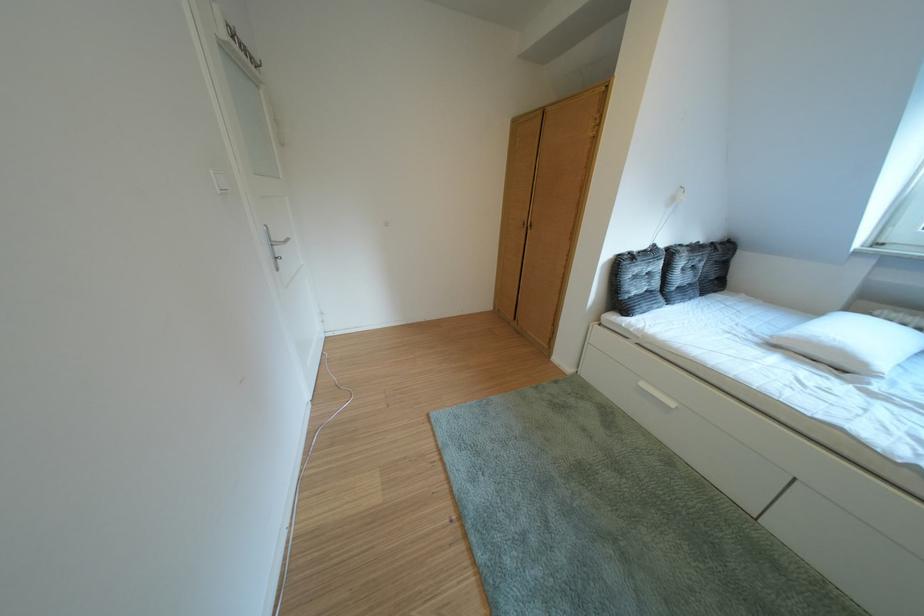
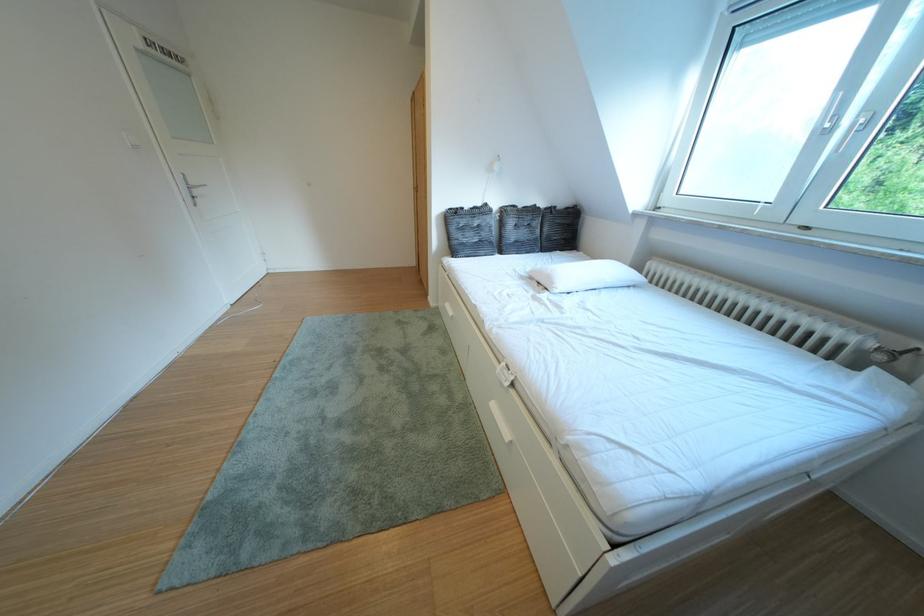
In the second image, find the point that corresponds to (x=878, y=369) in the first image.

(565, 288)